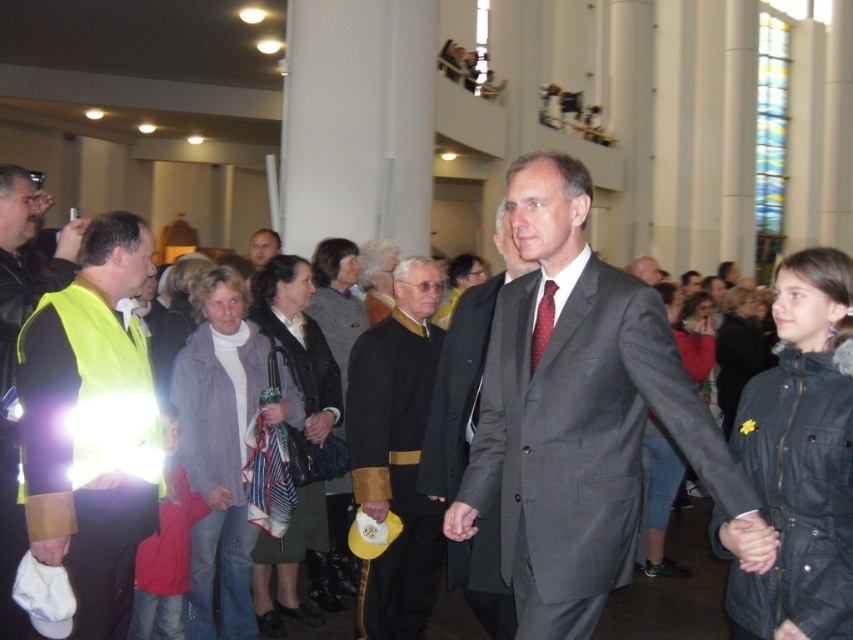
You are an event planner setting up a photo shoot in this venue. You need to position a camera to capture both the dark blue fabric coat at lower right and the black velvet robe at center in the same frame. Based on their positions, which object should be placed closer to the right side of the camera frame?

The dark blue fabric coat at lower right should be placed closer to the right side of the camera frame because it is positioned to the right of the black velvet robe at center in the scene.

You are standing at the entrance of the building and see the gray wool suit at center and the black leather jacket at center. Which one is nearer to you?

The gray wool suit at center is closer to the viewer than the black leather jacket at center.

You are organizing a charity event and need to arrange seating based on the size of the coats. The dark blue fabric coat at lower right and the black leather jacket at center are both on a coat rack. Which coat should you place on the smaller hanger?

The dark blue fabric coat at lower right should be placed on the smaller hanger because it has a smaller size compared to the black leather jacket at center.